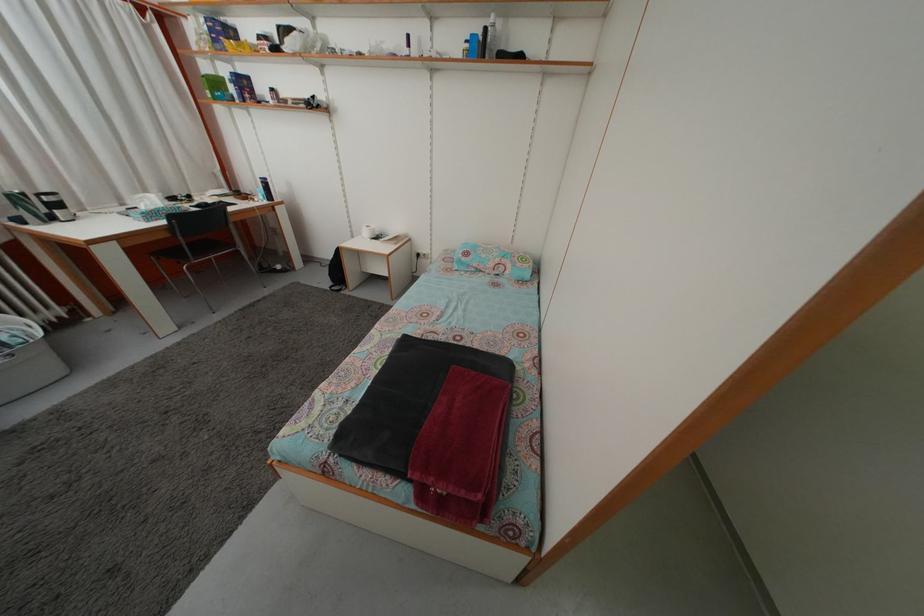
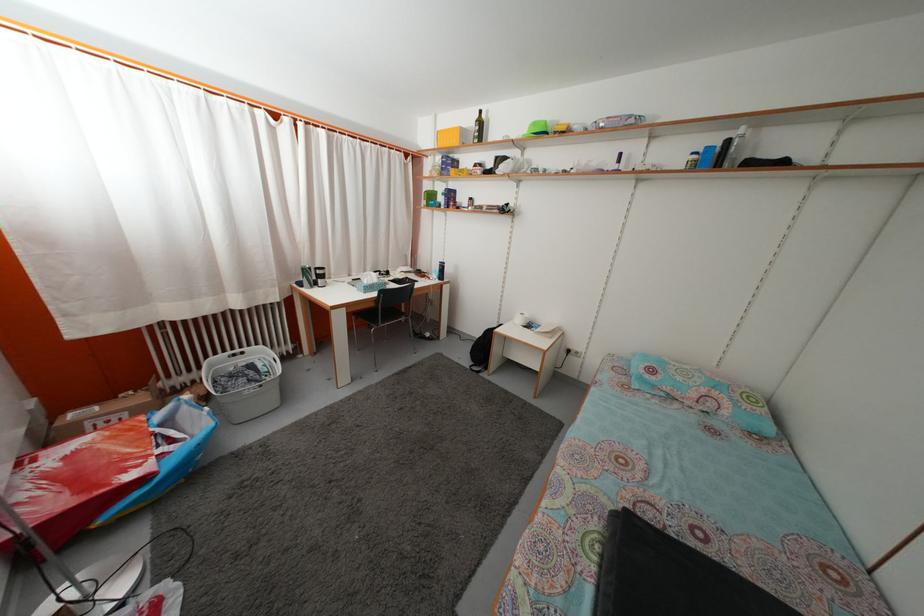
Where in the second image is the point corresponding to pixel 128 213 from the first image?

(355, 283)